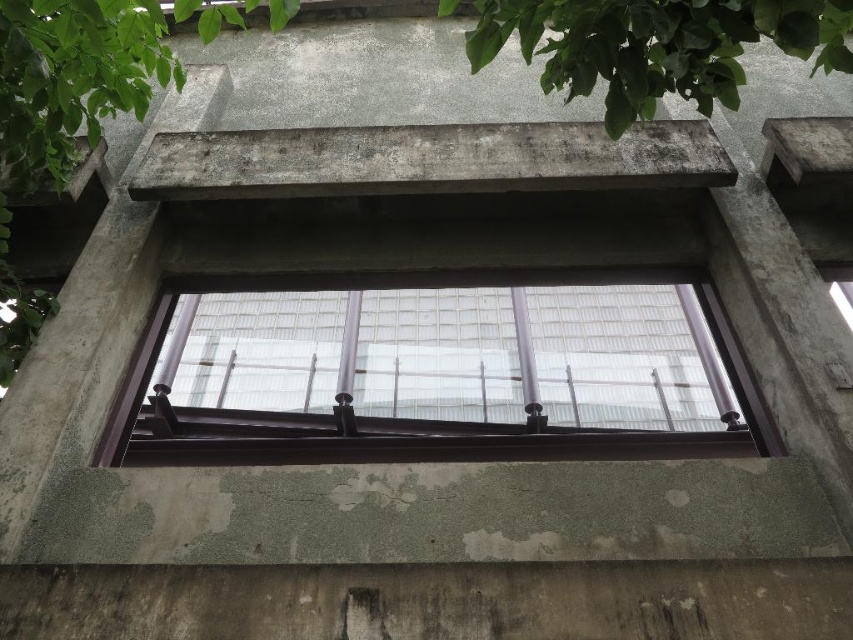
Is clear glass window at center thinner than green leafy tree at upper center?

No.

How much distance is there between clear glass window at center and green leafy tree at upper center?

A distance of 5.34 feet exists between clear glass window at center and green leafy tree at upper center.

Is point (235, 384) positioned in front of point (838, 28)?

No, (235, 384) is behind (838, 28).

Locate an element on the screen. The height and width of the screenshot is (640, 853). clear glass window at center is located at coordinates (x=444, y=376).